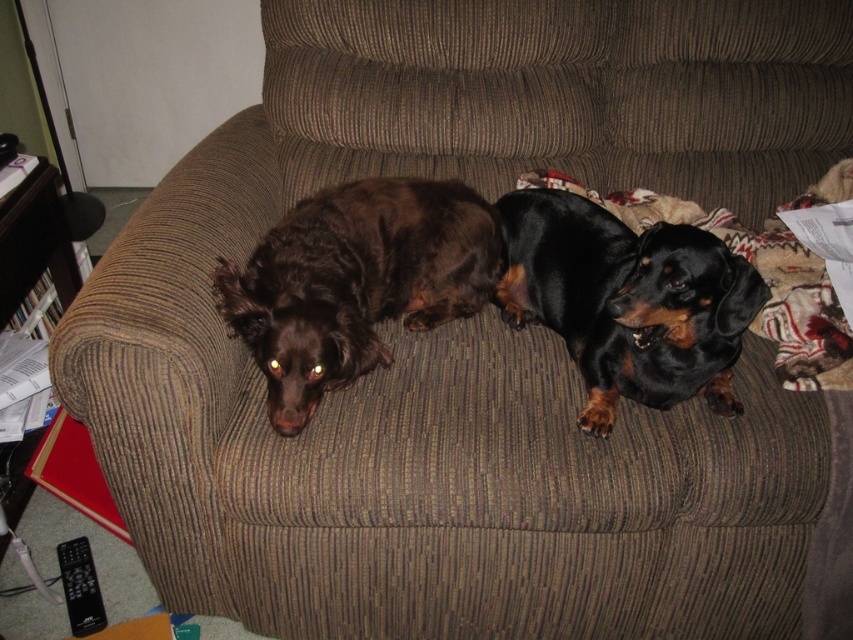
Question: Can you confirm if shiny brown dog at center is positioned to the right of black shiny dog at center?

Choices:
 (A) no
 (B) yes

Answer: (A)

Question: Does shiny brown dog at center have a larger size compared to black shiny dog at center?

Choices:
 (A) yes
 (B) no

Answer: (B)

Question: Which of the following is the farthest from the observer?

Choices:
 (A) shiny brown dog at center
 (B) black shiny dog at center

Answer: (A)

Question: Observing the image, what is the correct spatial positioning of shiny brown dog at center in reference to black shiny dog at center?

Choices:
 (A) below
 (B) above

Answer: (B)

Question: Among these points, which one is farthest from the camera?

Choices:
 (A) (321, 372)
 (B) (726, 408)

Answer: (B)

Question: Which object appears farthest from the camera in this image?

Choices:
 (A) black shiny dog at center
 (B) shiny brown dog at center

Answer: (B)